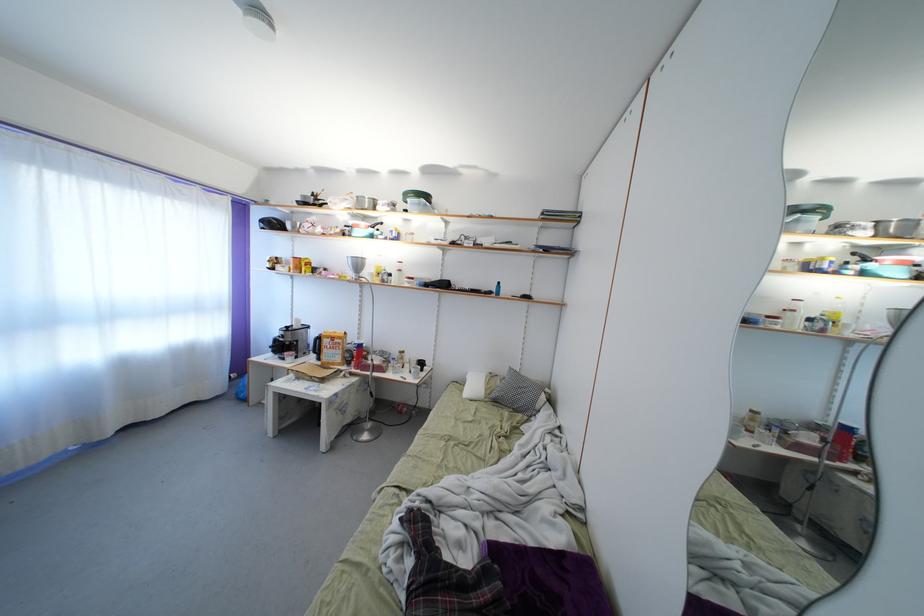
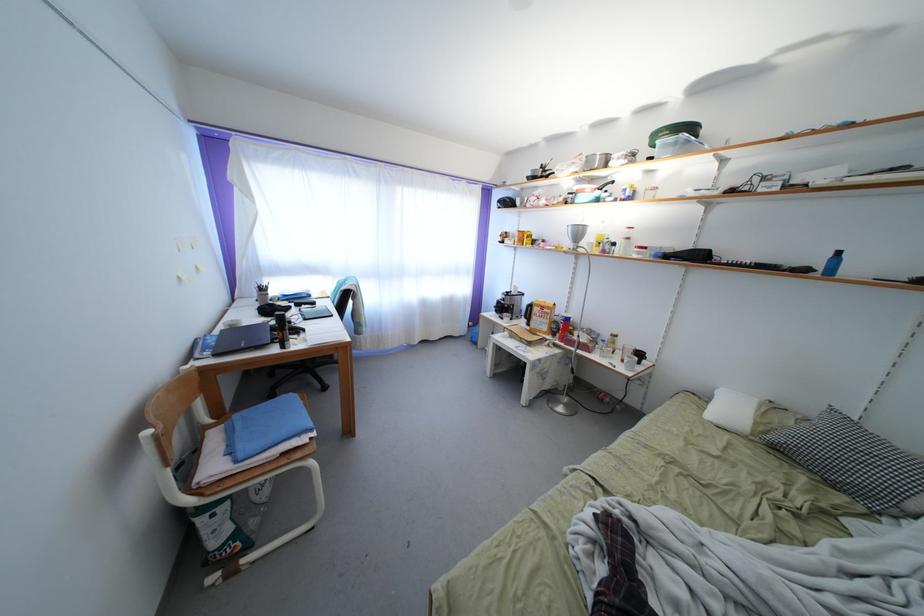
Where in the second image is the point corresponding to [365,206] from the first image?

(594, 166)